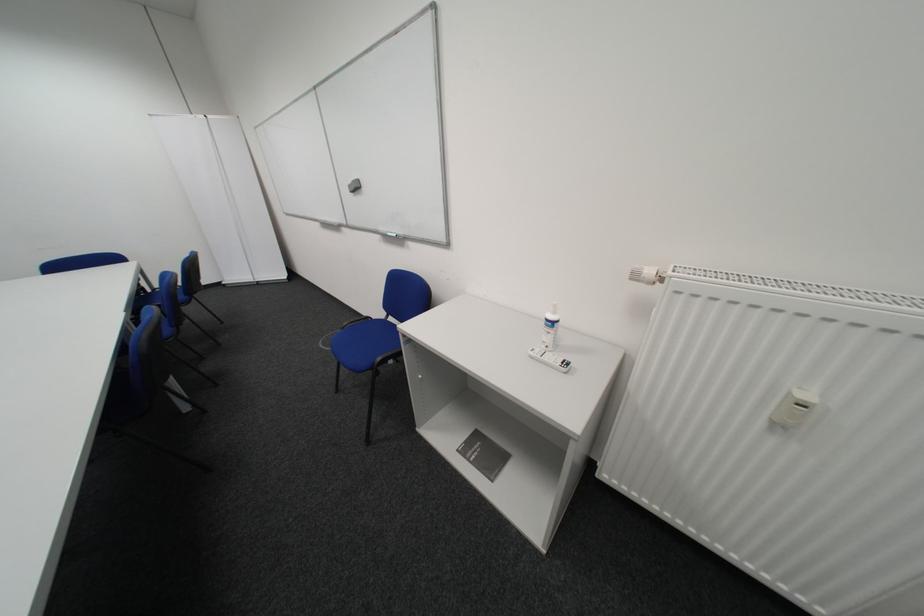
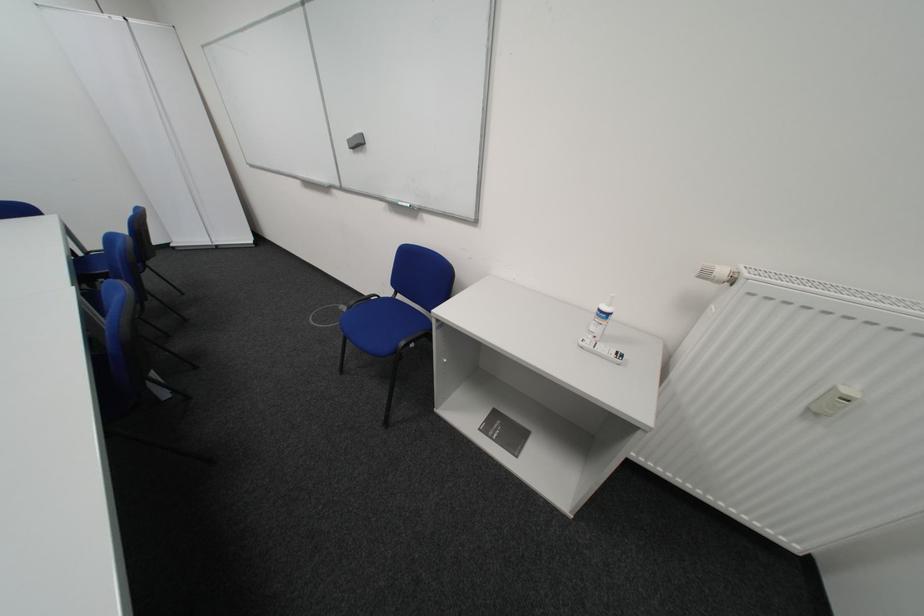
Locate, in the second image, the point that corresponds to (x=560, y=321) in the first image.

(611, 312)